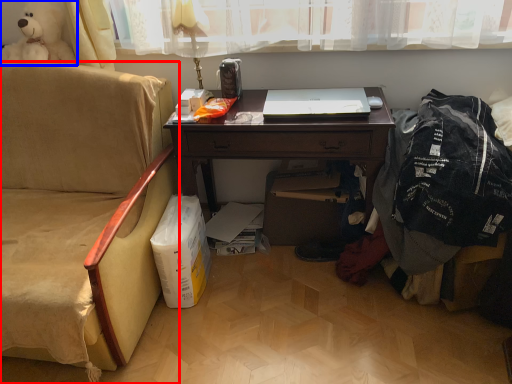
Question: Among these objects, which one is nearest to the camera, chair (highlighted by a red box) or toy (highlighted by a blue box)?

Choices:
 (A) chair
 (B) toy

Answer: (A)